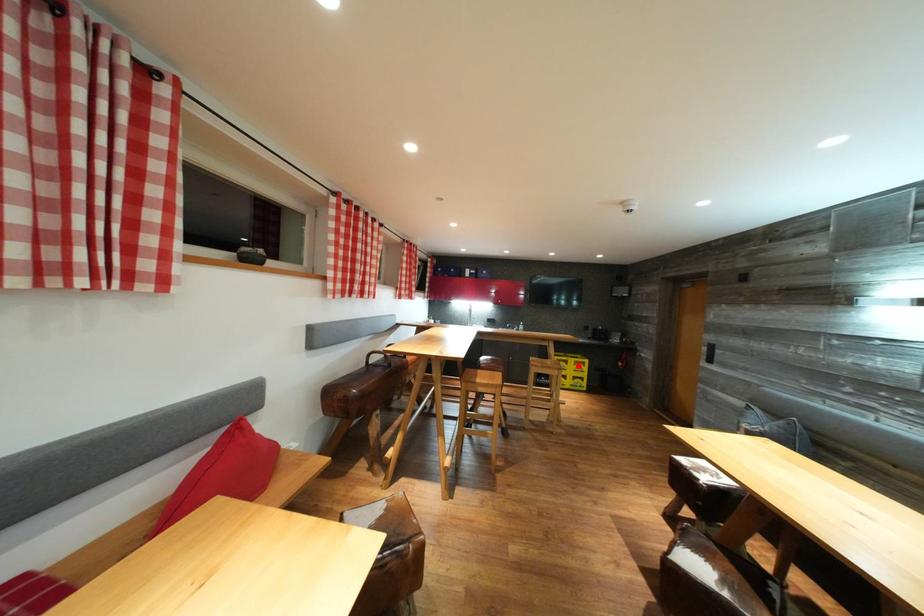
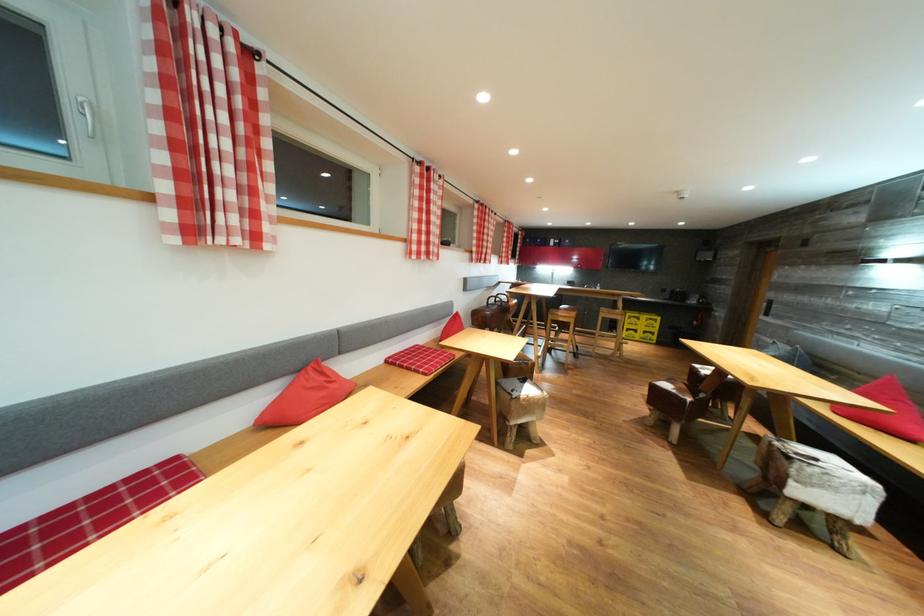
Question: I am providing you with two images of the same scene from different viewpoints. A red point is shown in image1. For the corresponding object point in image2, is it positioned nearer or farther from the camera?

Choices:
 (A) Nearer
 (B) Farther

Answer: (A)